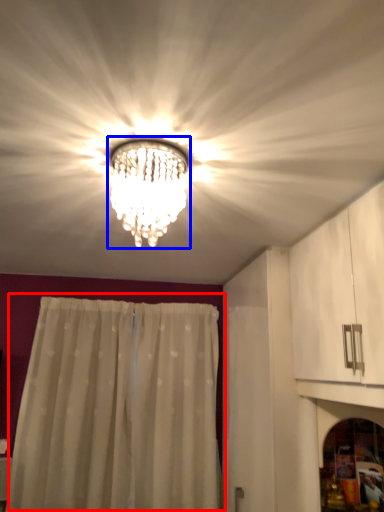
Question: Which object is closer to the camera taking this photo, curtain (highlighted by a red box) or lamp (highlighted by a blue box)?

Choices:
 (A) curtain
 (B) lamp

Answer: (B)